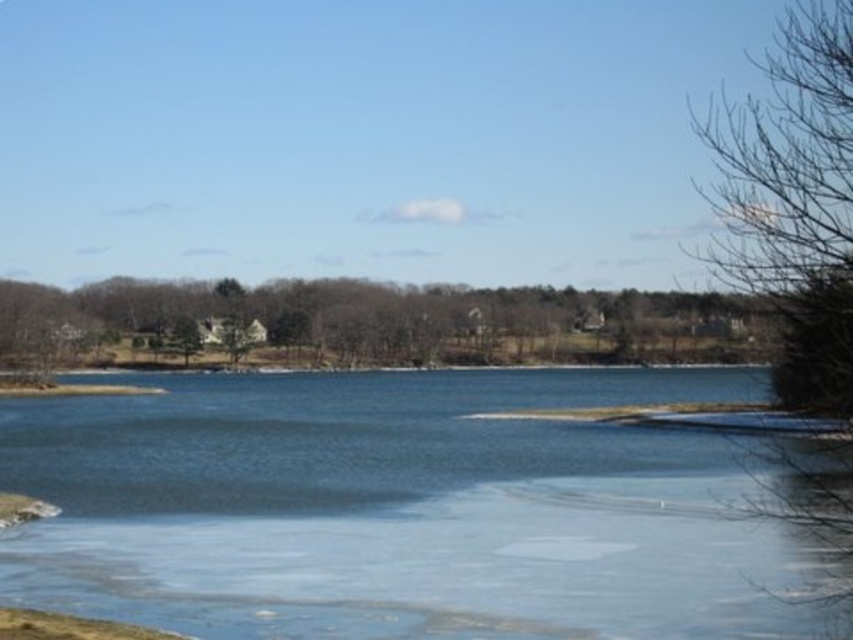
You are an artist sketching the lakeside scene. You want to draw the brown textured tree at center and the bare branches at right accurately. Which of the two has a wider spread in terms of their trunk and branches?

The brown textured tree at center has a larger width than the bare branches at right, so it has a wider spread in terms of their trunk and branches.

You are a hiker planning to cross the clear ice at center to reach the bare branches at right. Given that the distance between them is 29.15 meters and your average walking speed is 1.5 meters per second, how many seconds will it take you to reach the branches?

The distance between the clear ice at center and the bare branches at right is 29.15 meters. At a walking speed of 1.5 meters per second, it would take approximately 19.43 seconds to reach the branches.